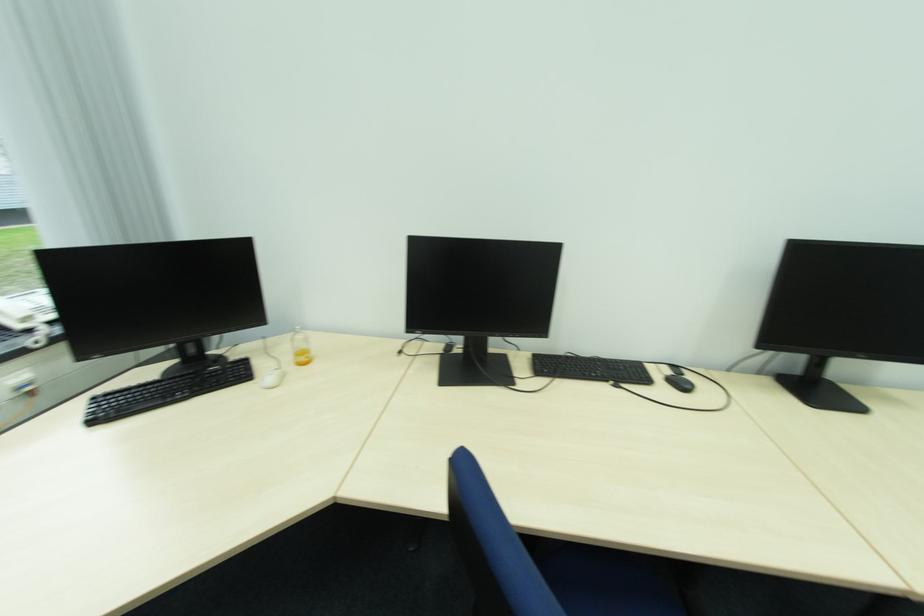
The width and height of the screenshot is (924, 616). What do you see at coordinates (16, 315) in the screenshot?
I see `the telephone handset` at bounding box center [16, 315].